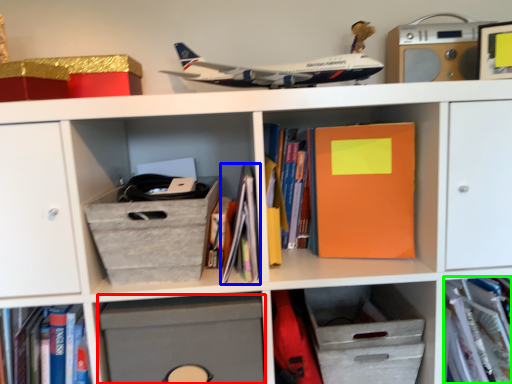
Question: Which object is the farthest from cabinet (highlighted by a red box)? Choose among these: book (highlighted by a blue box) or book (highlighted by a green box).

Choices:
 (A) book
 (B) book

Answer: (B)